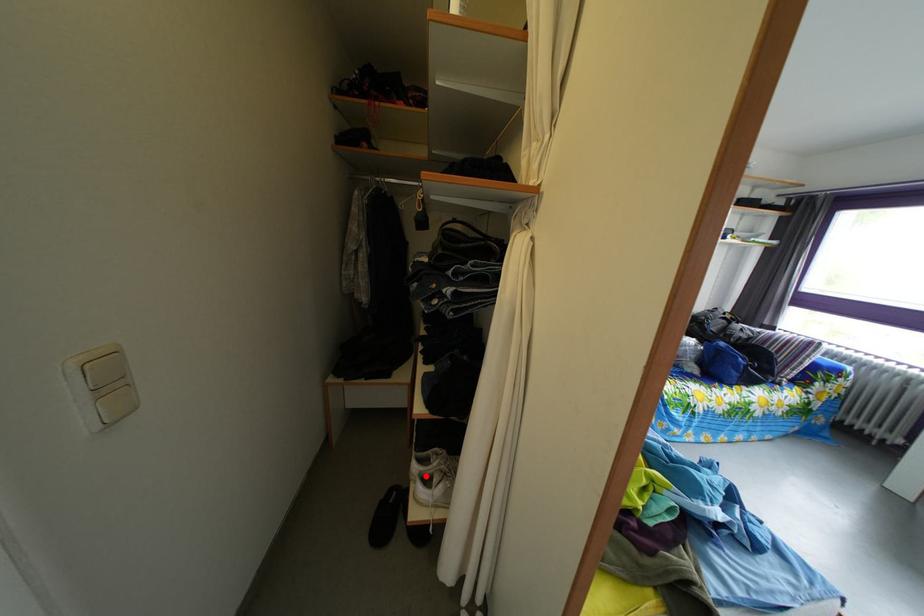
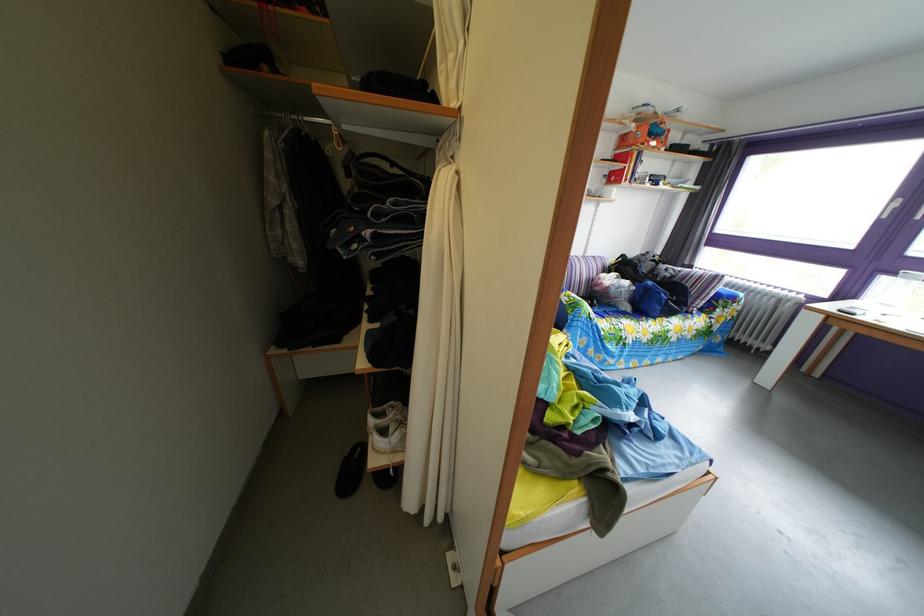
Find the pixel in the second image that matches the highlighted location in the first image.

(383, 430)